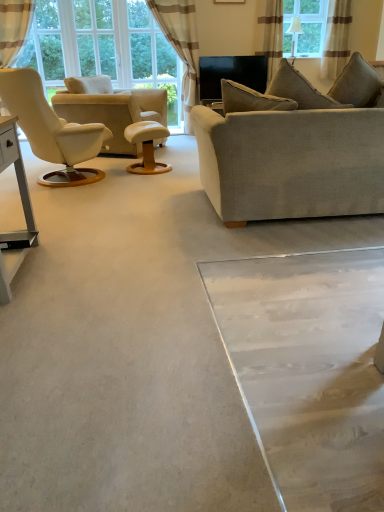
Question: Does wooden round table at center turn towards beige leather chair at left?

Choices:
 (A) yes
 (B) no

Answer: (B)

Question: Is wooden round table at center shorter than beige leather chair at left?

Choices:
 (A) no
 (B) yes

Answer: (B)

Question: Is wooden round table at center located outside beige leather chair at left?

Choices:
 (A) yes
 (B) no

Answer: (A)

Question: From a real-world perspective, is wooden round table at center physically below beige leather chair at left?

Choices:
 (A) yes
 (B) no

Answer: (A)

Question: Can you confirm if wooden round table at center is wider than beige leather chair at left?

Choices:
 (A) no
 (B) yes

Answer: (A)

Question: In the image, is transparent glass door at upper center on the left side or the right side of textured beige pillow at upper right?

Choices:
 (A) right
 (B) left

Answer: (B)

Question: In terms of width, does transparent glass door at upper center look wider or thinner when compared to textured beige pillow at upper right?

Choices:
 (A) wide
 (B) thin

Answer: (B)

Question: Considering their positions, is transparent glass door at upper center located in front of or behind textured beige pillow at upper right?

Choices:
 (A) front
 (B) behind

Answer: (B)

Question: Is transparent glass door at upper center inside or outside of textured beige pillow at upper right?

Choices:
 (A) inside
 (B) outside

Answer: (B)

Question: Which is correct: brown striped curtain at upper right, which appears as the second curtain when viewed from the left, is inside textured beige pillow at upper right, or outside of it?

Choices:
 (A) inside
 (B) outside

Answer: (B)

Question: Is point (269, 38) closer or farther from the camera than point (334, 92)?

Choices:
 (A) closer
 (B) farther

Answer: (B)

Question: Relative to textured beige pillow at upper right, is brown striped curtain at upper right, the second curtain viewed from the right, in front or behind?

Choices:
 (A) front
 (B) behind

Answer: (B)

Question: From a real-world perspective, is brown striped curtain at upper right, the second curtain viewed from the right, positioned above or below textured beige pillow at upper right?

Choices:
 (A) below
 (B) above

Answer: (B)

Question: Does point (316, 2) appear closer or farther from the camera than point (362, 58)?

Choices:
 (A) farther
 (B) closer

Answer: (A)

Question: From the image's perspective, is clear glass window at upper center located above or below textured beige pillow at upper right?

Choices:
 (A) above
 (B) below

Answer: (A)